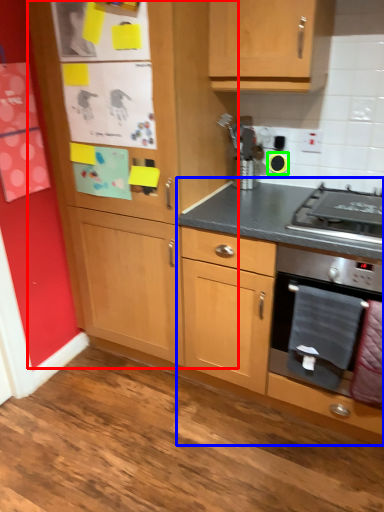
Question: Which is farther away from cabinetry (highlighted by a red box)? cabinetry (highlighted by a blue box) or appliance (highlighted by a green box)?

Choices:
 (A) cabinetry
 (B) appliance

Answer: (B)